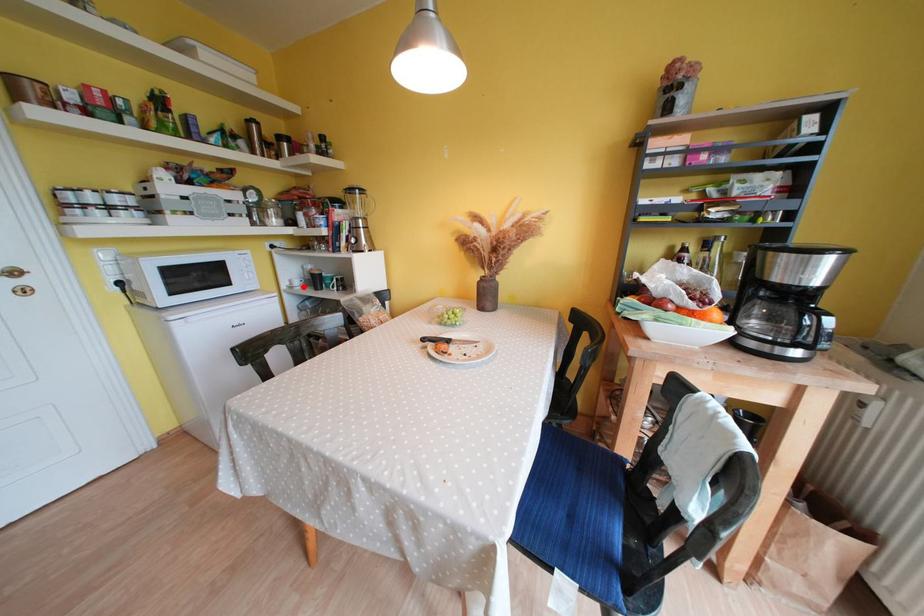
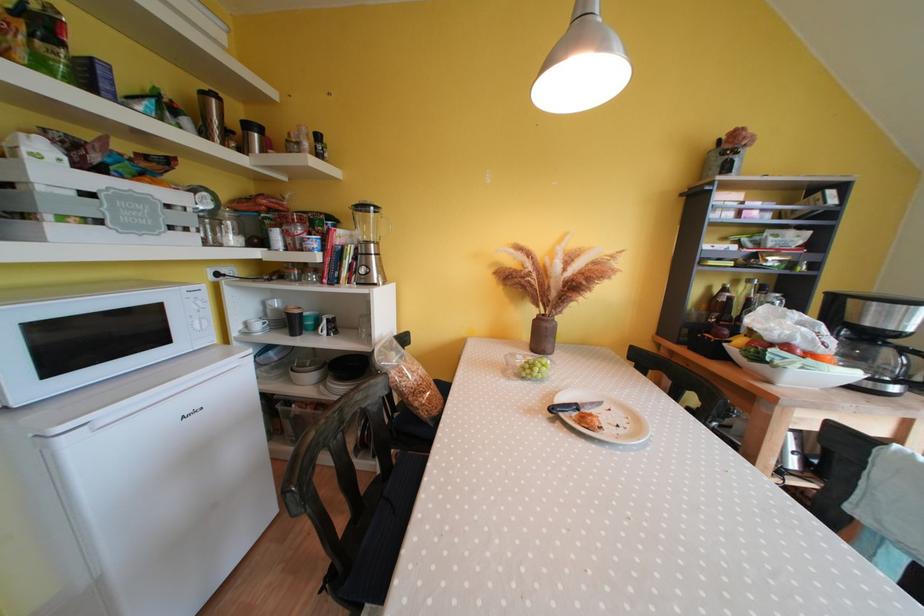
Locate, in the second image, the point that corresponds to the highlighted location in the first image.

(264, 330)